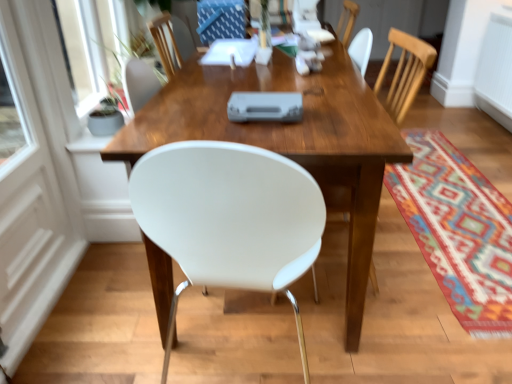
Describe the element at coordinates (289, 140) in the screenshot. This screenshot has width=512, height=384. I see `wooden table at center` at that location.

Find the location of a particular element. This screenshot has width=512, height=384. multicolored woven mat at lower right is located at coordinates click(x=458, y=230).

Measure the distance between point (42, 321) and camera.

The depth of point (42, 321) is 5.10 feet.

Find the location of a particular element. This screenshot has height=384, width=512. wooden table at center is located at coordinates (289, 140).

Is there a large distance between multicolored woven mat at lower right and wooden table at center?

multicolored woven mat at lower right is actually quite close to wooden table at center.

Between multicolored woven mat at lower right and wooden table at center, which one has larger width?

With larger width is wooden table at center.

From a real-world perspective, is multicolored woven mat at lower right under wooden table at center?

Correct, in the physical world, multicolored woven mat at lower right is lower than wooden table at center.

Is wooden table at center far away from white glossy door at left?

Actually, wooden table at center and white glossy door at left are a little close together.

Based on the photo, is white glossy door at left at the back of wooden table at center?

Correct, wooden table at center is looking away from white glossy door at left.

From the picture: Between wooden table at center and white glossy door at left, which one is positioned behind?

Positioned behind is wooden table at center.

Considering the relative positions of wooden table at center and multicolored woven mat at lower right in the image provided, is wooden table at center to the right of multicolored woven mat at lower right from the viewer's perspective?

No, wooden table at center is not to the right of multicolored woven mat at lower right.

Which of these two, wooden table at center or multicolored woven mat at lower right, is wider?

wooden table at center is wider.

Find the location of `table in front of the multicolored woven mat at lower right`. table in front of the multicolored woven mat at lower right is located at coordinates [289, 140].

Considering the sizes of objects white glossy door at left and multicolored woven mat at lower right in the image provided, who is wider, white glossy door at left or multicolored woven mat at lower right?

With larger width is multicolored woven mat at lower right.

Measure the distance between white glossy door at left and multicolored woven mat at lower right.

They are 1.75 meters apart.

Is white glossy door at left touching multicolored woven mat at lower right?

No, white glossy door at left is not with multicolored woven mat at lower right.

Is point (55, 297) positioned in front of point (481, 266)?

Yes.

Which is behind, point (470, 289) or point (7, 36)?

The point (470, 289) is more distant.

In the scene shown: Is multicolored woven mat at lower right positioned far away from white glossy door at left?

multicolored woven mat at lower right is positioned a significant distance from white glossy door at left.

Is multicolored woven mat at lower right thinner than white glossy door at left?

In fact, multicolored woven mat at lower right might be wider than white glossy door at left.

Is white glossy door at left positioned beyond the bounds of wooden table at center?

Absolutely, white glossy door at left is external to wooden table at center.

Is white glossy door at left turned away from wooden table at center?

white glossy door at left does not have its back to wooden table at center.

From a real-world perspective, is white glossy door at left positioned under wooden table at center based on gravity?

No.

Considering the positions of objects white glossy door at left and wooden table at center in the image provided, who is behind, white glossy door at left or wooden table at center?

wooden table at center is further away from the camera.

Identify the location of mat below the wooden table at center (from the image's perspective). (458, 230).

Where is `table located behind the white glossy door at left`? Image resolution: width=512 pixels, height=384 pixels. table located behind the white glossy door at left is located at coordinates (289, 140).

Looking at the image, which one is located further to multicolored woven mat at lower right, white glossy door at left or wooden table at center?

white glossy door at left.

From the image, which object appears to be farther from multicolored woven mat at lower right, wooden table at center or white glossy door at left?

Based on the image, white glossy door at left appears to be further to multicolored woven mat at lower right.

From the image, which object appears to be nearer to white glossy door at left, multicolored woven mat at lower right or wooden table at center?

wooden table at center.

Considering their positions, is wooden table at center positioned closer to white glossy door at left than multicolored woven mat at lower right?

wooden table at center is closer to white glossy door at left.

Looking at this image, based on their spatial positions, is white glossy door at left or multicolored woven mat at lower right closer to wooden table at center?

Among the two, white glossy door at left is located nearer to wooden table at center.

Which object lies further to the anchor point wooden table at center, multicolored woven mat at lower right or white glossy door at left?

multicolored woven mat at lower right.

I want to click on table located between white glossy door at left and multicolored woven mat at lower right in the left-right direction, so click(289, 140).